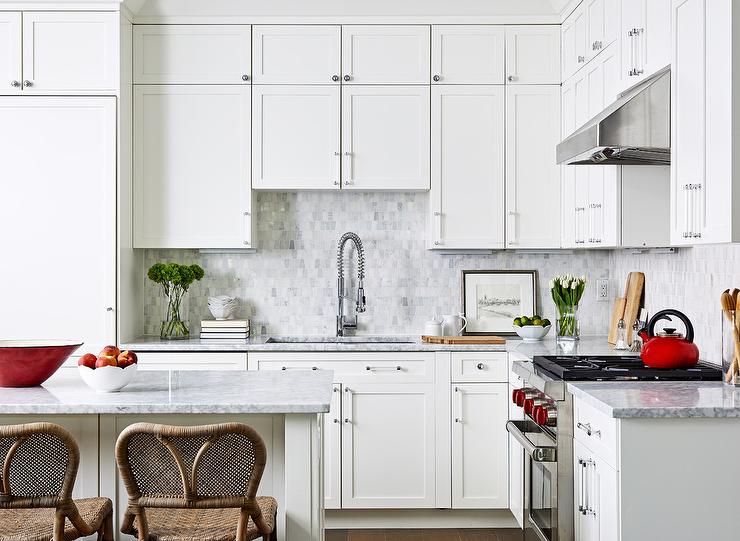
Identify the location of picture. (507, 295).